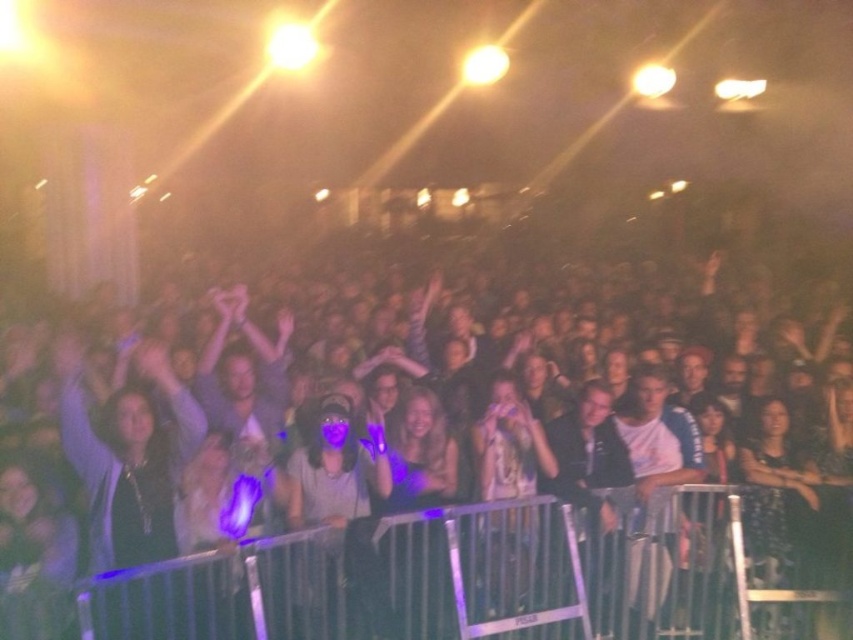
Which is below, matte black crowd at center or matte purple shirt at center?

Positioned lower is matte purple shirt at center.

Does point (402, 632) come closer to viewer compared to point (357, 593)?

No, it is behind (357, 593).

In order to click on matte black crowd at center in this screenshot , I will do `click(453, 508)`.